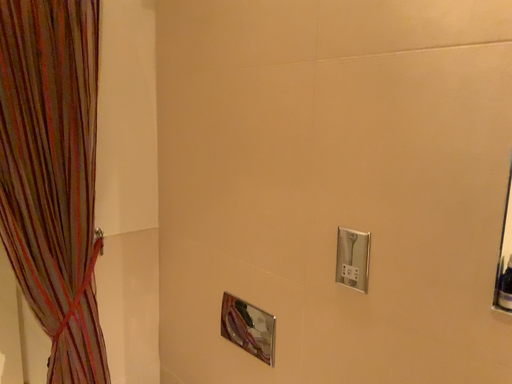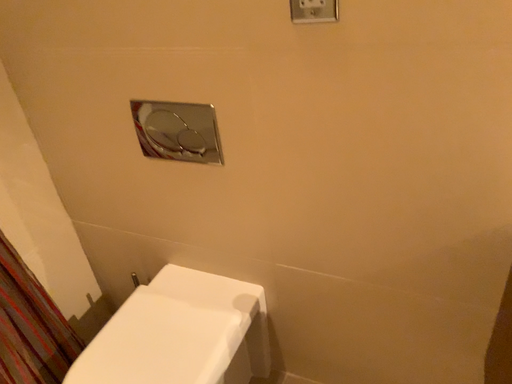
Question: How did the camera likely rotate when shooting the video?

Choices:
 (A) rotated left
 (B) rotated right

Answer: (B)